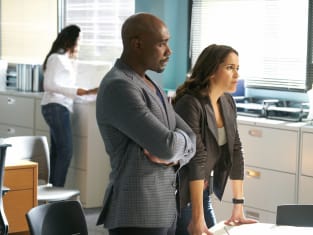
Where is `white table top`? The height and width of the screenshot is (235, 313). white table top is located at coordinates (228, 229).